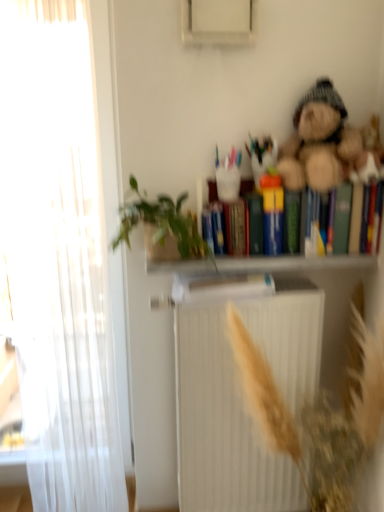
Question: Considering the positions of white matte radiator at center and green leafy plant at upper center in the image, is white matte radiator at center wider or thinner than green leafy plant at upper center?

Choices:
 (A) wide
 (B) thin

Answer: (B)

Question: From a real-world perspective, relative to green leafy plant at upper center, is white matte radiator at center vertically above or below?

Choices:
 (A) below
 (B) above

Answer: (A)

Question: Considering the real-world distances, which object is farthest from the green leafy plant at upper center?

Choices:
 (A) white matte bookcase at upper center
 (B) multicolored hardcover books at upper right
 (C) white matte radiator at center
 (D) white sheer curtain at left
 (E) fuzzy brown teddy bear at upper right

Answer: (B)

Question: Which object is positioned closest to the white sheer curtain at left?

Choices:
 (A) green leafy plant at upper center
 (B) fuzzy brown teddy bear at upper right
 (C) multicolored hardcover books at upper right
 (D) white matte bookcase at upper center
 (E) white matte radiator at center

Answer: (A)